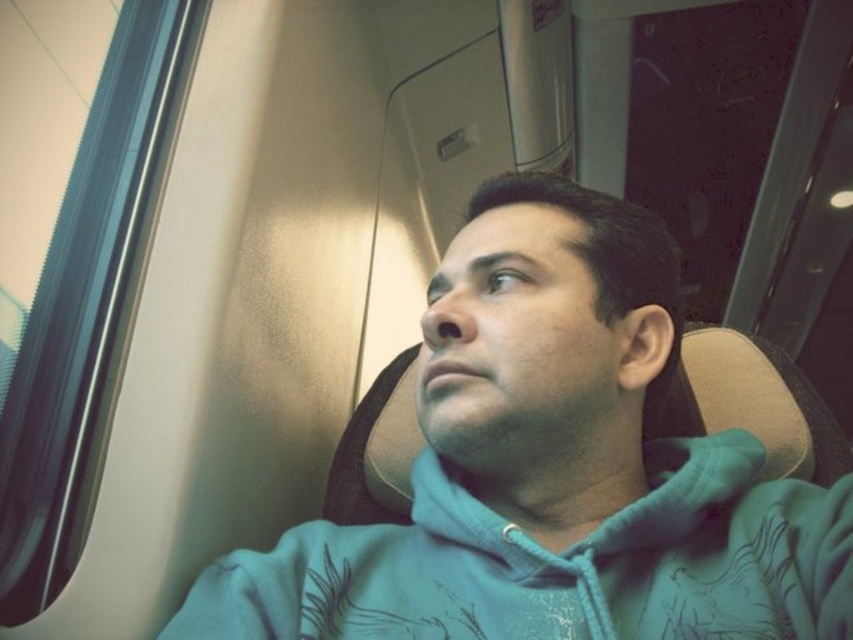
You are a fashion designer observing the person in the train compartment wearing two layers of clothing. The outer layer is the teal hoodie at center and the inner layer is the teal fleece sweatshirt at center. Can you determine which garment is larger in size?

The teal hoodie at center is bigger than the teal fleece sweatshirt at center, so the outer layer is larger in size.

You are a passenger on a train and notice two teal garments at the center of the scene. Which one is closer to you, the teal hoodie at center or the teal fleece sweatshirt at center?

The teal hoodie at center is closer to you because it is in front of the teal fleece sweatshirt at center.

You are a fashion designer observing a person wearing two layers of clothing in the train compartment. The person has a teal hoodie at center and a teal fleece sweatshirt at center. Which clothing item is taller?

The teal hoodie at center is much taller than the teal fleece sweatshirt at center.